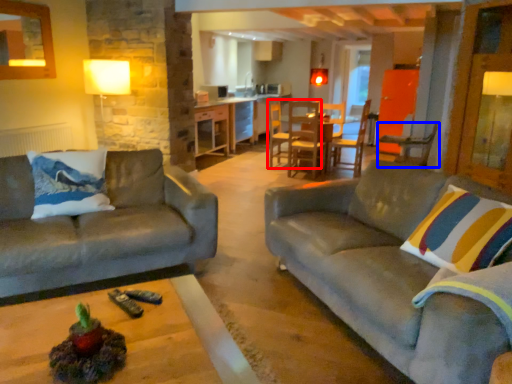
Question: Among these objects, which one is farthest to the camera, chair (highlighted by a red box) or chair (highlighted by a blue box)?

Choices:
 (A) chair
 (B) chair

Answer: (A)